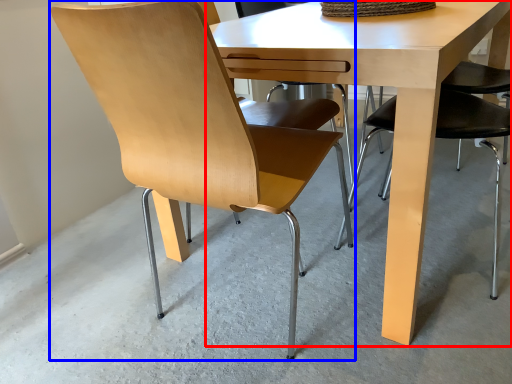
Question: Which object is closer to the camera taking this photo, table (highlighted by a red box) or chair (highlighted by a blue box)?

Choices:
 (A) table
 (B) chair

Answer: (B)